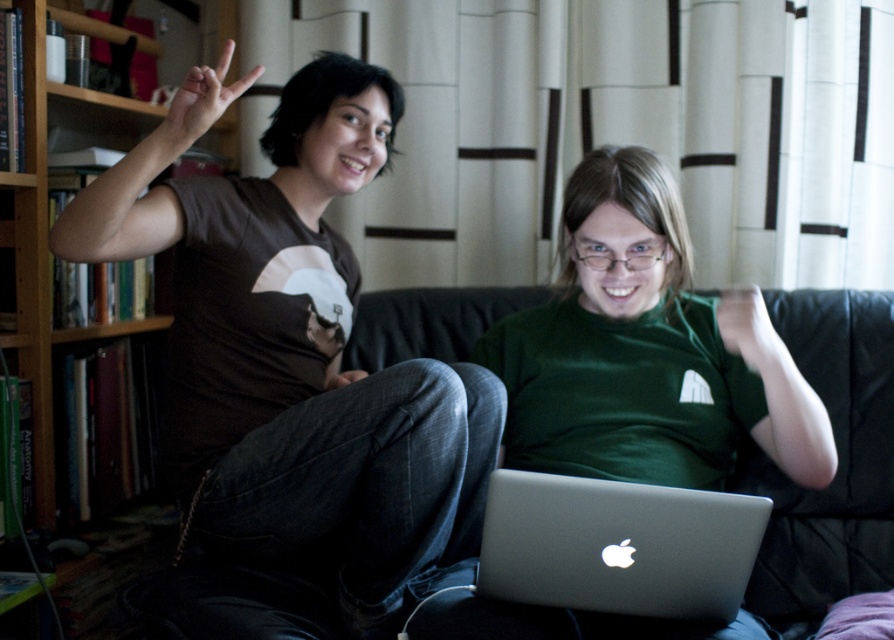
Question: Which point is closer to the camera?

Choices:
 (A) (139, 120)
 (B) (842, 428)

Answer: (B)

Question: Can you confirm if silver metallic laptop at center is wider than wooden bookshelf at left?

Choices:
 (A) no
 (B) yes

Answer: (B)

Question: Among these objects, which one is nearest to the camera?

Choices:
 (A) matte black hand at upper left
 (B) wooden bookshelf at left
 (C) matte green t-shirt at center

Answer: (A)

Question: Can you confirm if black leather couch at center is wider than wooden bookshelf at left?

Choices:
 (A) yes
 (B) no

Answer: (A)

Question: Where is black leather couch at center located in relation to wooden bookshelf at left in the image?

Choices:
 (A) right
 (B) left

Answer: (A)

Question: Which of the following is the farthest from the observer?

Choices:
 (A) (656, 538)
 (B) (891, 566)
 (C) (140, 120)
 (D) (651, 406)

Answer: (C)